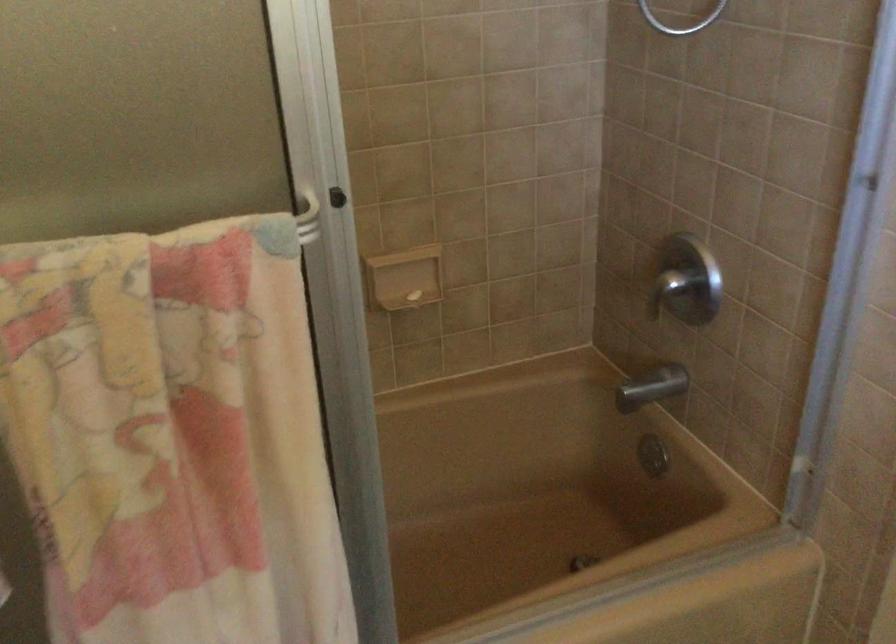
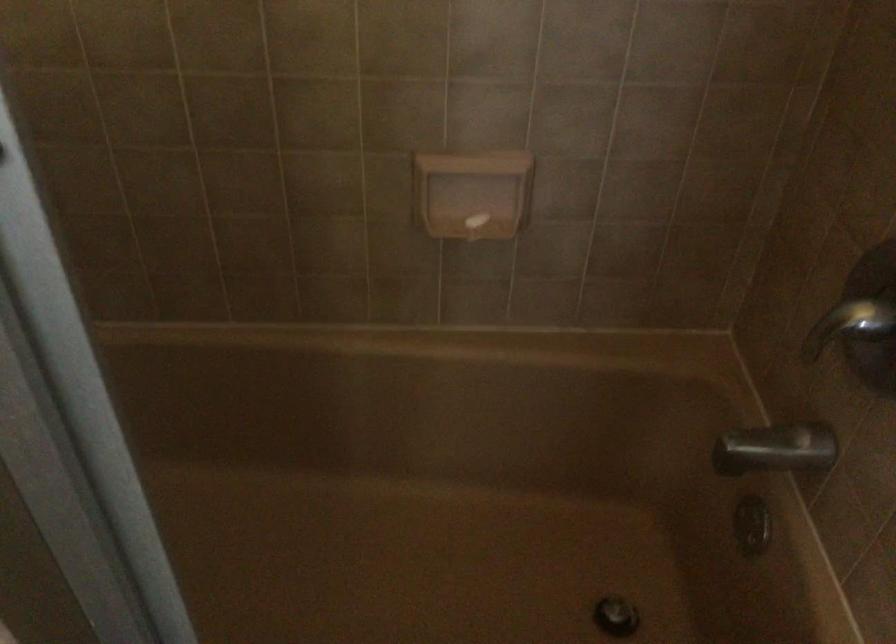
Locate, in the second image, the point that corresponds to pixel 412 298 in the first image.

(476, 221)